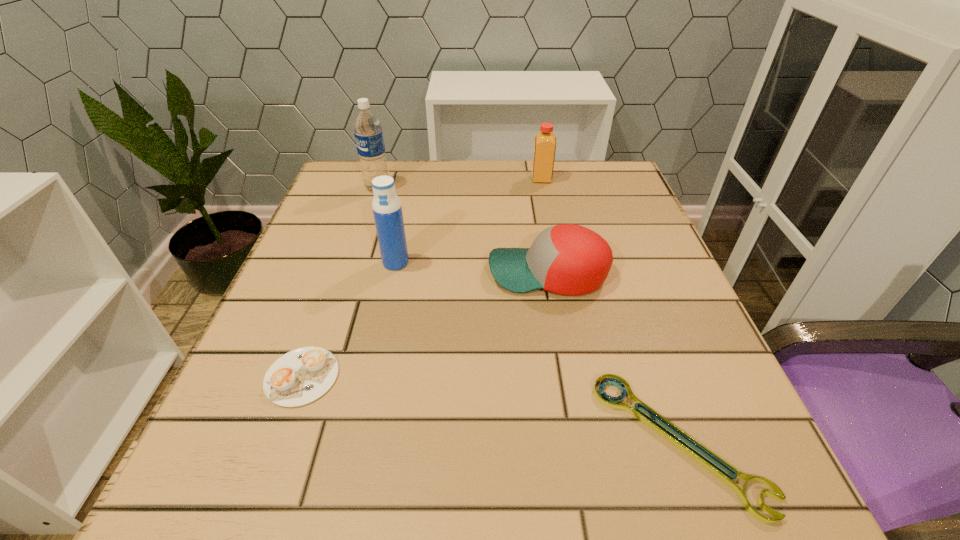
Find the location of a particular element. The height and width of the screenshot is (540, 960). the farther water bottle is located at coordinates (367, 128).

Find the location of `the third object from left to right`. the third object from left to right is located at coordinates (387, 210).

Where is `the nearer water bottle`? This screenshot has width=960, height=540. the nearer water bottle is located at coordinates (387, 210).

Locate an element on the screen. This screenshot has height=540, width=960. the fourth shortest object is located at coordinates (545, 141).

Image resolution: width=960 pixels, height=540 pixels. Identify the location of baseball cap. (568, 259).

Image resolution: width=960 pixels, height=540 pixels. What are the coordinates of `cappuccino` in the screenshot? It's located at (301, 376).

Find the location of a particular element. Image resolution: width=960 pixels, height=540 pixels. the shortest object is located at coordinates (606, 400).

Find the location of a particular element. Image resolution: width=960 pixels, height=540 pixels. free region located on the front of the farther water bottle is located at coordinates (363, 231).

Where is `free spot located on the back of the third object from left to right`? Image resolution: width=960 pixels, height=540 pixels. free spot located on the back of the third object from left to right is located at coordinates (408, 206).

Where is `vacant space situated 0.110m on the front and back of the fourth shortest object`? This screenshot has height=540, width=960. vacant space situated 0.110m on the front and back of the fourth shortest object is located at coordinates (489, 179).